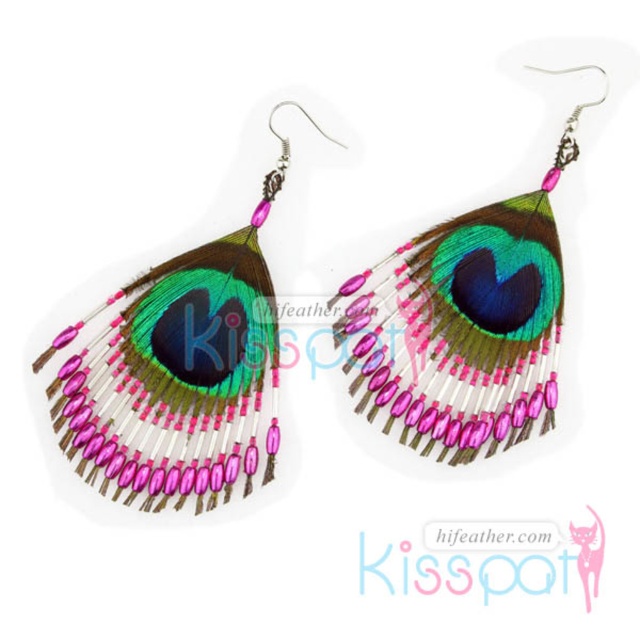
You are an appraiser examining a pair of earrings. You notice the multicolored feather earrings at left and the multicolored feather earrings at center. Which one appears closer to you?

The multicolored feather earrings at left appears closer because it is in front of the multicolored feather earrings at center.

Looking at this image, you are looking at a display of earrings. There are two pairs visible in the image. One is labeled as the multicolored feather earrings at left and the other as the multicolored feather earrings at center. From your perspective, which pair is positioned further to the left?

The multicolored feather earrings at left are positioned further to the left compared to the multicolored feather earrings at center.